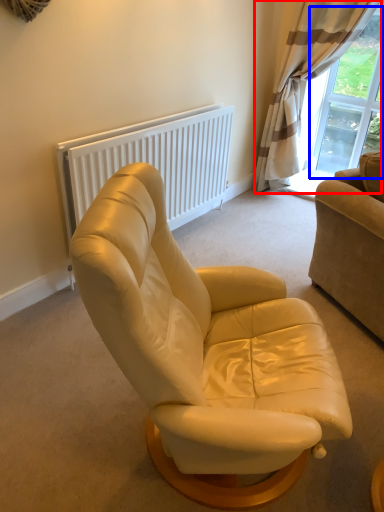
Question: Which point is further to the camera, curtain (highlighted by a red box) or window screen (highlighted by a blue box)?

Choices:
 (A) curtain
 (B) window screen

Answer: (B)